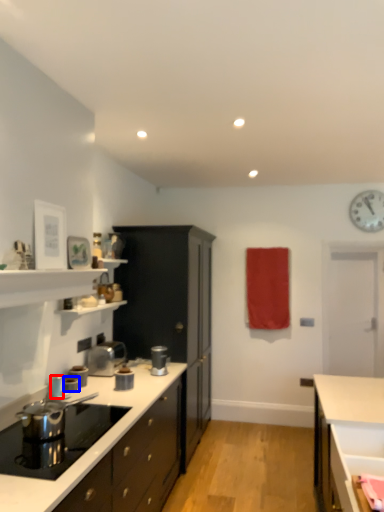
Question: Which of the following is the closest to the observer, kitchen appliance (highlighted by a red box) or kitchen appliance (highlighted by a blue box)?

Choices:
 (A) kitchen appliance
 (B) kitchen appliance

Answer: (A)